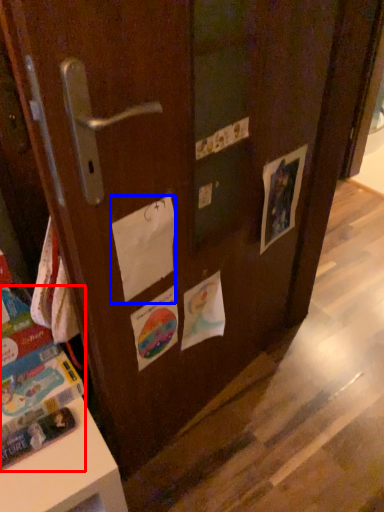
Question: Which of the following is the farthest to the observer, book (highlighted by a red box) or paper (highlighted by a blue box)?

Choices:
 (A) book
 (B) paper

Answer: (A)